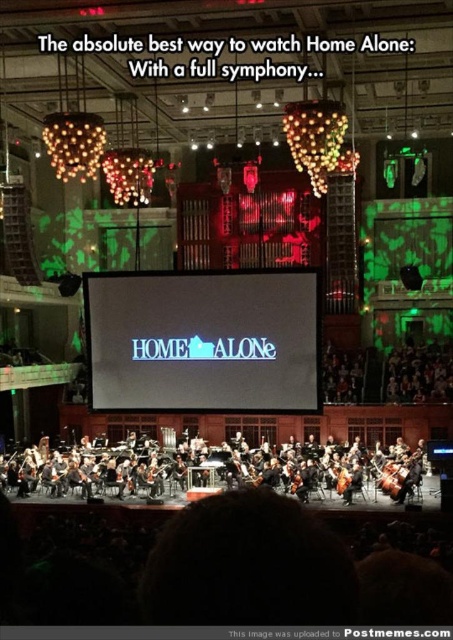
You are a stagehand who needs to move a large equipment cart through the stage. The cart is as wide as the matte black cello at center. Will the cart fit through the space reserved for the black glossy orchestra at center?

The black glossy orchestra at center is wider than the matte black cello at center, so the cart, which is as wide as the matte black cello at center, will fit through the space reserved for the black glossy orchestra at center.

You are sitting in the audience of the concert hall and want to look at the blue glossy screen at center. Which direction should you turn your head to face the screen?

The blue glossy screen at center is located at point (x=202, y=340), which is directly in front of you. You should look straight ahead to face the screen.